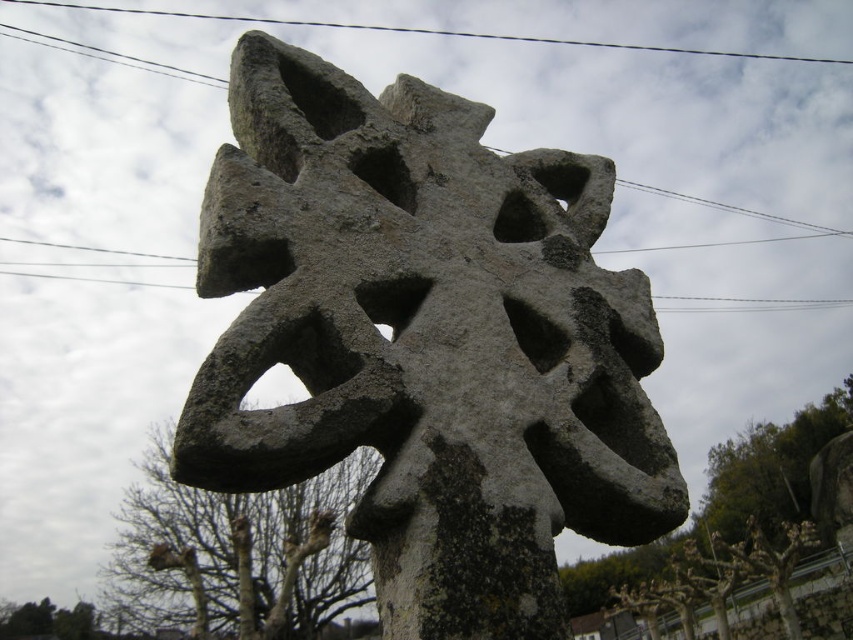
Consider the image. Does gray stone cross at center have a lesser width compared to black wire at upper center?

Indeed, gray stone cross at center has a lesser width compared to black wire at upper center.

Image resolution: width=853 pixels, height=640 pixels. I want to click on gray stone cross at center, so click(x=426, y=342).